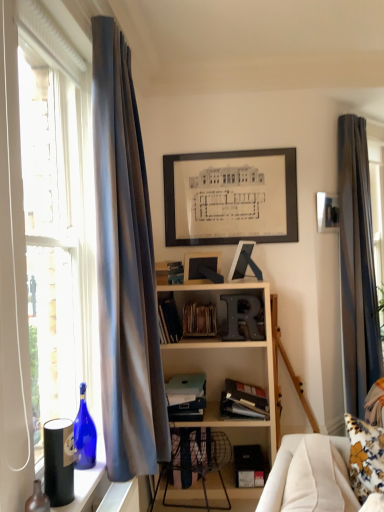
Find the location of a particular element. The height and width of the screenshot is (512, 384). blank area beneath hardcover book at center, the 3th book from the bottom (from a real-world perspective) is located at coordinates (170, 384).